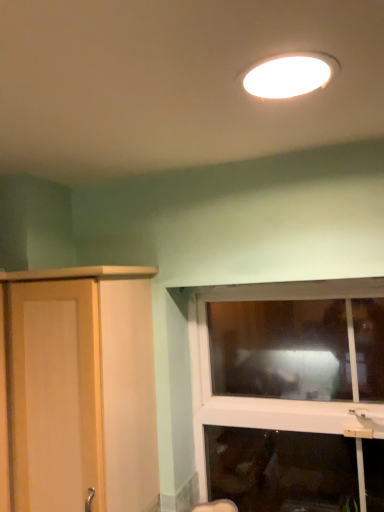
What do you see at coordinates (290, 75) in the screenshot?
I see `white glossy light fixture at upper center` at bounding box center [290, 75].

Identify the location of light wood cupboard at left. The image size is (384, 512). (77, 389).

The width and height of the screenshot is (384, 512). Find the location of `transparent glass window at lower right`. transparent glass window at lower right is located at coordinates (289, 393).

Between light wood cupboard at left and transparent glass window at lower right, which one has more height?

Standing taller between the two is light wood cupboard at left.

The image size is (384, 512). In order to click on cupboard lying in front of the transparent glass window at lower right in this screenshot , I will do `click(77, 389)`.

Can you tell me how much light wood cupboard at left and transparent glass window at lower right differ in facing direction?

The angular difference between light wood cupboard at left and transparent glass window at lower right is 0.432 degrees.

Consider the image. From a real-world perspective, is light wood cupboard at left physically located above or below transparent glass window at lower right?

From a real-world perspective, light wood cupboard at left is physically above transparent glass window at lower right.

From the image's perspective, who appears lower, transparent glass window at lower right or white glossy light fixture at upper center?

transparent glass window at lower right, from the image's perspective.

Based on the photo, does transparent glass window at lower right have a smaller size compared to white glossy light fixture at upper center?

No.

Is point (200, 379) farther from camera compared to point (293, 84)?

Yes, it is.

Looking at this image, is transparent glass window at lower right not inside white glossy light fixture at upper center?

transparent glass window at lower right is positioned outside white glossy light fixture at upper center.

From a real-world perspective, is white glossy light fixture at upper center below transparent glass window at lower right?

Actually, white glossy light fixture at upper center is physically above transparent glass window at lower right in the real world.

Considering the positions of point (268, 91) and point (270, 317), is point (268, 91) closer or farther from the camera than point (270, 317)?

Point (268, 91) appears to be closer to the viewer than point (270, 317).

From the image's perspective, relative to transparent glass window at lower right, is white glossy light fixture at upper center above or below?

white glossy light fixture at upper center is above transparent glass window at lower right.

What's the angular difference between white glossy light fixture at upper center and transparent glass window at lower right's facing directions?

They differ by 90.4 degrees in their facing directions.

What's the angular difference between light wood cupboard at left and white glossy light fixture at upper center's facing directions?

The angle between the facing direction of light wood cupboard at left and the facing direction of white glossy light fixture at upper center is 90.8 degrees.

Is light wood cupboard at left positioned behind white glossy light fixture at upper center?

Yes, it is.

Based on the photo, between light wood cupboard at left and white glossy light fixture at upper center, which one appears on the right side from the viewer's perspective?

white glossy light fixture at upper center.

Would you say light wood cupboard at left is inside or outside white glossy light fixture at upper center?

light wood cupboard at left is outside white glossy light fixture at upper center.

Image resolution: width=384 pixels, height=512 pixels. I want to click on window behind the light wood cupboard at left, so click(289, 393).

Is transparent glass window at lower right beside light wood cupboard at left?

No, transparent glass window at lower right is not in contact with light wood cupboard at left.

Which is nearer, (x=224, y=458) or (x=69, y=318)?

Clearly, point (x=224, y=458) is more distant from the camera than point (x=69, y=318).

Which object is closer to the camera taking this photo, transparent glass window at lower right or light wood cupboard at left?

light wood cupboard at left is more forward.

Is there a large distance between white glossy light fixture at upper center and light wood cupboard at left?

That's not correct — white glossy light fixture at upper center is a little close to light wood cupboard at left.

Does white glossy light fixture at upper center have a lesser width compared to light wood cupboard at left?

Indeed, white glossy light fixture at upper center has a lesser width compared to light wood cupboard at left.

From a real-world perspective, which is physically below, white glossy light fixture at upper center or light wood cupboard at left?

In real-world perspective, light wood cupboard at left is lower.

Is light wood cupboard at left at the back of white glossy light fixture at upper center?

white glossy light fixture at upper center is not turned away from light wood cupboard at left.

Where is `cupboard lying above the transparent glass window at lower right (from the image's perspective)`? The image size is (384, 512). cupboard lying above the transparent glass window at lower right (from the image's perspective) is located at coordinates point(77,389).

Where is `lamp to the left of transparent glass window at lower right`? The image size is (384, 512). lamp to the left of transparent glass window at lower right is located at coordinates (290, 75).

Estimate the real-world distances between objects in this image. Which object is closer to transparent glass window at lower right, white glossy light fixture at upper center or light wood cupboard at left?

light wood cupboard at left lies closer to transparent glass window at lower right than the other object.

Looking at the image, which one is located further to light wood cupboard at left, transparent glass window at lower right or white glossy light fixture at upper center?

transparent glass window at lower right is positioned further to the anchor light wood cupboard at left.

When comparing their distances from white glossy light fixture at upper center, does light wood cupboard at left or transparent glass window at lower right seem closer?

Among the two, light wood cupboard at left is located nearer to white glossy light fixture at upper center.

Looking at the image, which one is located further to light wood cupboard at left, white glossy light fixture at upper center or transparent glass window at lower right?

transparent glass window at lower right is positioned further to the anchor light wood cupboard at left.

From the picture: Considering their positions, is light wood cupboard at left positioned closer to transparent glass window at lower right than white glossy light fixture at upper center?

Based on the image, light wood cupboard at left appears to be nearer to transparent glass window at lower right.

Considering their positions, is transparent glass window at lower right positioned closer to white glossy light fixture at upper center than light wood cupboard at left?

light wood cupboard at left.

Where is `cupboard between white glossy light fixture at upper center and transparent glass window at lower right in the vertical direction`? cupboard between white glossy light fixture at upper center and transparent glass window at lower right in the vertical direction is located at coordinates (77, 389).